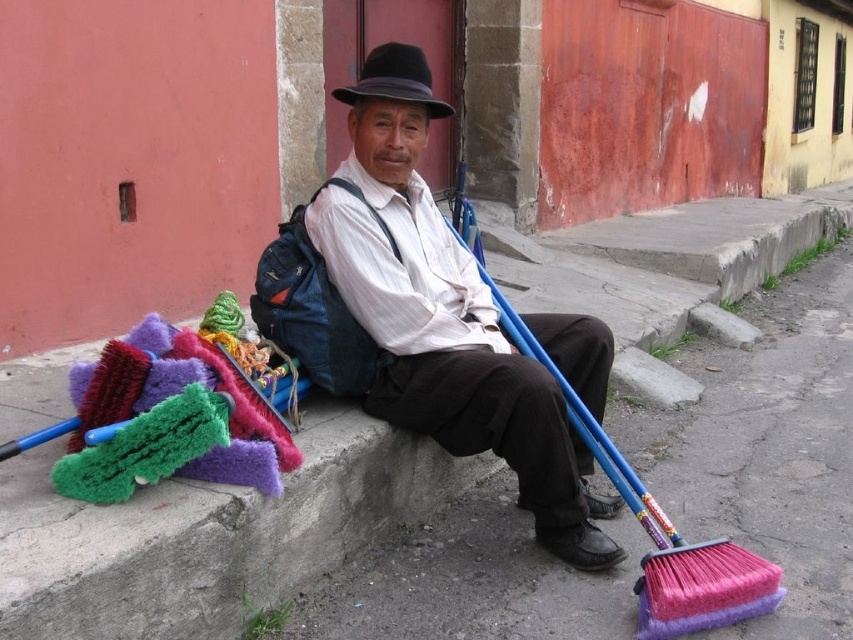
Question: Can you confirm if matte white shirt at center is positioned to the left of pink bristle broom at lower right?

Choices:
 (A) yes
 (B) no

Answer: (A)

Question: Can you confirm if matte white shirt at center is thinner than black felt fedora at center?

Choices:
 (A) yes
 (B) no

Answer: (B)

Question: Is matte white shirt at center in front of pink bristle broom at lower right?

Choices:
 (A) no
 (B) yes

Answer: (A)

Question: Which of the following is the closest to the observer?

Choices:
 (A) pos(396,76)
 (B) pos(553,465)
 (C) pos(659,589)

Answer: (C)

Question: Which object is the farthest from the pink bristle broom at lower right?

Choices:
 (A) matte white shirt at center
 (B) black felt fedora at center

Answer: (B)

Question: Which object appears closest to the camera in this image?

Choices:
 (A) pink bristle broom at lower right
 (B) black felt fedora at center

Answer: (A)